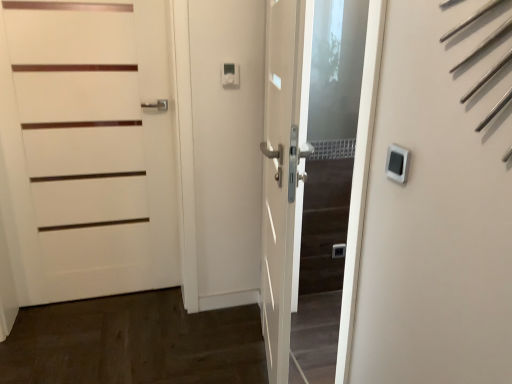
What do you see at coordinates (227, 147) in the screenshot?
I see `white matte door at center` at bounding box center [227, 147].

At what (x,y) coordinates should I click in order to perform the action: click on white plastic thermostat at upper right. Please return your answer as a coordinate pair (x, y). The image size is (512, 384). Looking at the image, I should click on (397, 163).

Is point (287, 328) positioned in front of point (125, 111)?

Yes, it is.

From the image's perspective, is white matte door at center, the 1th door positioned from the right, above or below white matte door at left, the 1th door from the left?

Clearly, from the image's perspective, white matte door at center, the 1th door positioned from the right, is below white matte door at left, the 1th door from the left.

Does white matte door at center, the second door in the left-to-right sequence, contain white matte door at left, the 1th door from the left?

No, white matte door at left, the 1th door from the left, is located outside of white matte door at center, the second door in the left-to-right sequence.

Is white matte door at center, the 1th door positioned from the right, to the right of white matte door at left, the second door positioned from the right, from the viewer's perspective?

Correct, you'll find white matte door at center, the 1th door positioned from the right, to the right of white matte door at left, the second door positioned from the right.

Is white matte door at center taller than white matte door at center, the 1th door positioned from the right?

No, white matte door at center is not taller than white matte door at center, the 1th door positioned from the right.

Does white matte door at center have a smaller size compared to white matte door at center, the second door in the left-to-right sequence?

Correct, white matte door at center occupies less space than white matte door at center, the second door in the left-to-right sequence.

Is white matte door at center in contact with white matte door at center, the second door in the left-to-right sequence?

No, white matte door at center is not next to white matte door at center, the second door in the left-to-right sequence.

Is white matte door at center outside of white matte door at center, the second door in the left-to-right sequence?

Yes, white matte door at center is not within white matte door at center, the second door in the left-to-right sequence.

Which is more to the right, white matte door at left, the second door positioned from the right, or white plastic thermostat at upper right?

white plastic thermostat at upper right.

From the picture: Is white matte door at left, the 1th door from the left, turned away from white plastic thermostat at upper right?

No, white matte door at left, the 1th door from the left, is not facing the opposite direction of white plastic thermostat at upper right.

Considering the relative sizes of white matte door at left, the second door positioned from the right, and white plastic thermostat at upper right in the image provided, is white matte door at left, the second door positioned from the right, bigger than white plastic thermostat at upper right?

Correct, white matte door at left, the second door positioned from the right, is larger in size than white plastic thermostat at upper right.

Between white matte door at left, the 1th door from the left, and white plastic thermostat at upper right, which one is positioned in front?

white plastic thermostat at upper right.

How many degrees apart are the facing directions of white matte door at center, the second door in the left-to-right sequence, and white matte door at center?

white matte door at center, the second door in the left-to-right sequence, and white matte door at center are facing 23.1 degrees away from each other.

How distant is white matte door at center, the 1th door positioned from the right, from white matte door at center?

white matte door at center, the 1th door positioned from the right, and white matte door at center are 18.33 inches apart from each other.

Where is `screen door below the white matte door at center, the 1th door positioned from the right (from the image's perspective)`? This screenshot has width=512, height=384. screen door below the white matte door at center, the 1th door positioned from the right (from the image's perspective) is located at coordinates (227, 147).

From a real-world perspective, is white matte door at center, the 1th door positioned from the right, positioned above or below white matte door at center?

white matte door at center, the 1th door positioned from the right, is situated higher than white matte door at center in the real world.

Which is more to the right, white matte door at center, the second door in the left-to-right sequence, or white plastic thermostat at upper right?

Positioned to the right is white plastic thermostat at upper right.

Between white matte door at center, the second door in the left-to-right sequence, and white plastic thermostat at upper right, which one is positioned in front?

white plastic thermostat at upper right is more forward.

Based on the photo, from the image's perspective, is white matte door at center, the 1th door positioned from the right, located above white plastic thermostat at upper right?

Incorrect, from the image's perspective, white matte door at center, the 1th door positioned from the right, is lower than white plastic thermostat at upper right.

From the image's perspective, between white plastic thermostat at upper right and white matte door at center, who is located below?

white matte door at center, from the image's perspective.

Can you confirm if white plastic thermostat at upper right is taller than white matte door at center?

No, white plastic thermostat at upper right is not taller than white matte door at center.

From the picture: Does white plastic thermostat at upper right have a lesser width compared to white matte door at center?

Yes.

Considering the sizes of objects white plastic thermostat at upper right and white matte door at center in the image provided, who is smaller, white plastic thermostat at upper right or white matte door at center?

With smaller size is white plastic thermostat at upper right.

Looking at this image, which object is wider, white matte door at center or white plastic thermostat at upper right?

With larger width is white matte door at center.

Considering the sizes of objects white matte door at center and white plastic thermostat at upper right in the image provided, who is taller, white matte door at center or white plastic thermostat at upper right?

white matte door at center.

The width and height of the screenshot is (512, 384). In the image, there is a white matte door at center, the second door in the left-to-right sequence. In order to click on door above it (from the image's perspective) in this screenshot , I will do `click(87, 147)`.

At what (x,y) coordinates should I click in order to perform the action: click on the 2nd door directly above the white matte door at center (from a real-world perspective). Please return your answer as a coordinate pair (x, y). The width and height of the screenshot is (512, 384). Looking at the image, I should click on (281, 175).

Which object lies further to the anchor point white plastic thermostat at upper right, white matte door at center, the 1th door positioned from the right, or white matte door at center?

white matte door at center is positioned further to the anchor white plastic thermostat at upper right.

Based on their spatial positions, is white matte door at left, the second door positioned from the right, or white plastic thermostat at upper right closer to white matte door at center?

white matte door at left, the second door positioned from the right, is closer to white matte door at center.

From the picture: Considering their positions, is white matte door at center, the second door in the left-to-right sequence, positioned closer to white matte door at center than white plastic thermostat at upper right?

The object closer to white matte door at center is white matte door at center, the second door in the left-to-right sequence.

Based on their spatial positions, is white matte door at center or white matte door at left, the 1th door from the left, further from white plastic thermostat at upper right?

white matte door at left, the 1th door from the left.

When comparing their distances from white matte door at left, the second door positioned from the right, does white matte door at center or white matte door at center, the 1th door positioned from the right, seem further?

white matte door at center, the 1th door positioned from the right, is further to white matte door at left, the second door positioned from the right.

Looking at the image, which one is located further to white matte door at left, the 1th door from the left, white matte door at center, the second door in the left-to-right sequence, or white matte door at center?

white matte door at center, the second door in the left-to-right sequence, lies further to white matte door at left, the 1th door from the left, than the other object.

Which object lies further to the anchor point white matte door at center, the 1th door positioned from the right, white matte door at center or white matte door at left, the second door positioned from the right?

white matte door at left, the second door positioned from the right.

Which object lies further to the anchor point white matte door at center, the 1th door positioned from the right, white plastic thermostat at upper right or white matte door at left, the 1th door from the left?

white matte door at left, the 1th door from the left, is further to white matte door at center, the 1th door positioned from the right.

Locate an element on the screen. screen door between white matte door at left, the 1th door from the left, and white matte door at center, the 1th door positioned from the right is located at coordinates (227, 147).

Identify the location of door between white matte door at center and white plastic thermostat at upper right from left to right. The width and height of the screenshot is (512, 384). (281, 175).

Image resolution: width=512 pixels, height=384 pixels. I want to click on door between white matte door at left, the 1th door from the left, and white plastic thermostat at upper right, in the horizontal direction, so click(x=281, y=175).

Image resolution: width=512 pixels, height=384 pixels. I want to click on screen door between white matte door at left, the second door positioned from the right, and white plastic thermostat at upper right, in the horizontal direction, so click(227, 147).